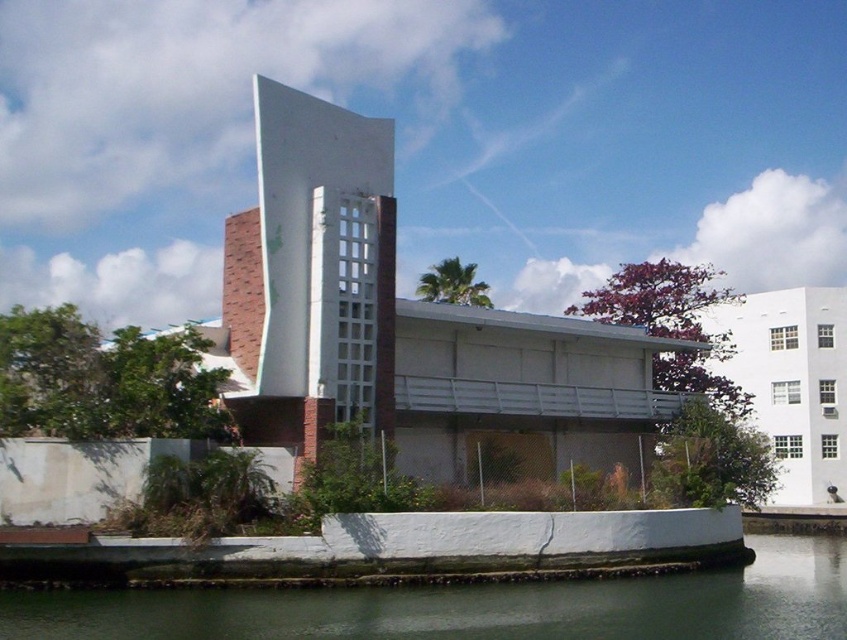
Question: Which of the following is the farthest from the observer?

Choices:
 (A) (278, 92)
 (B) (313, 616)

Answer: (A)

Question: Among these objects, which one is farthest from the camera?

Choices:
 (A) white glass tower at center
 (B) greenish water at lower center

Answer: (A)

Question: Does white glass tower at center have a larger size compared to greenish water at lower center?

Choices:
 (A) yes
 (B) no

Answer: (B)

Question: Is white glass tower at center closer to camera compared to greenish water at lower center?

Choices:
 (A) yes
 (B) no

Answer: (B)

Question: Can you confirm if white glass tower at center is smaller than greenish water at lower center?

Choices:
 (A) no
 (B) yes

Answer: (B)